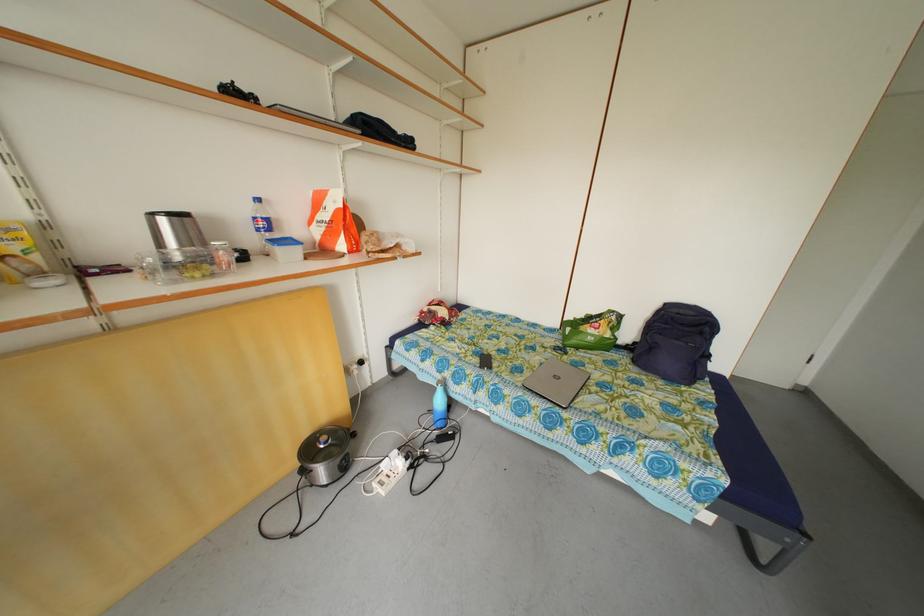
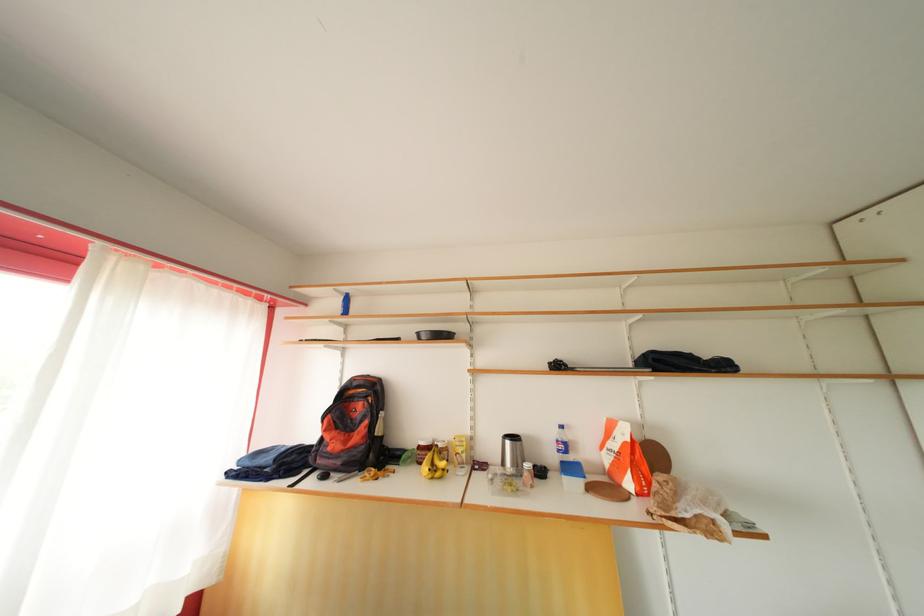
Based on the continuous images, in which direction is the camera rotating?

The rotation direction of the camera is left-up.